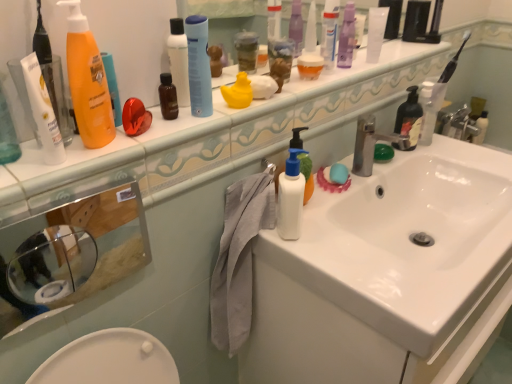
Locate an element on the screen. Image resolution: width=512 pixels, height=384 pixels. free location in front of orange matte bottle at upper left, the third cleaning product in the back-to-front sequence is located at coordinates (74, 171).